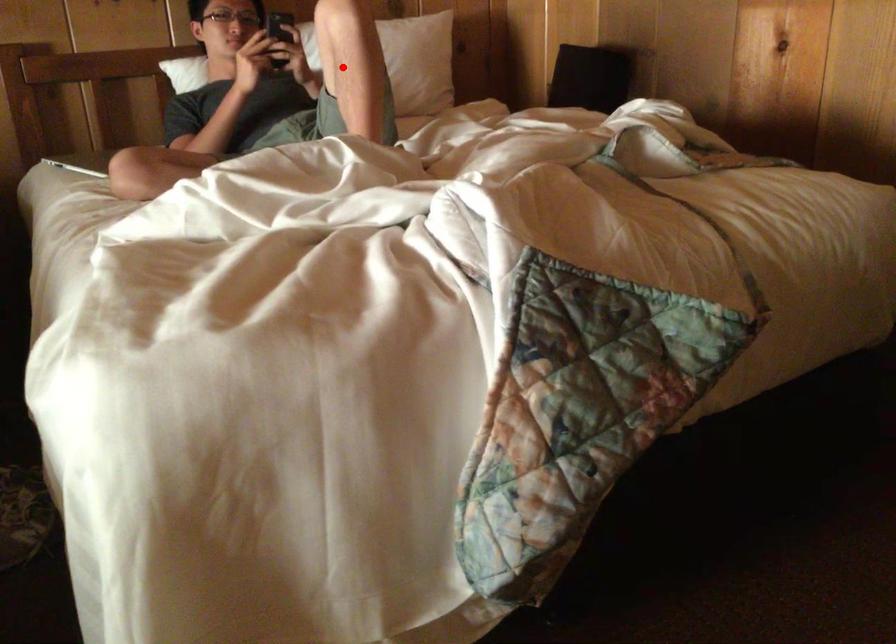
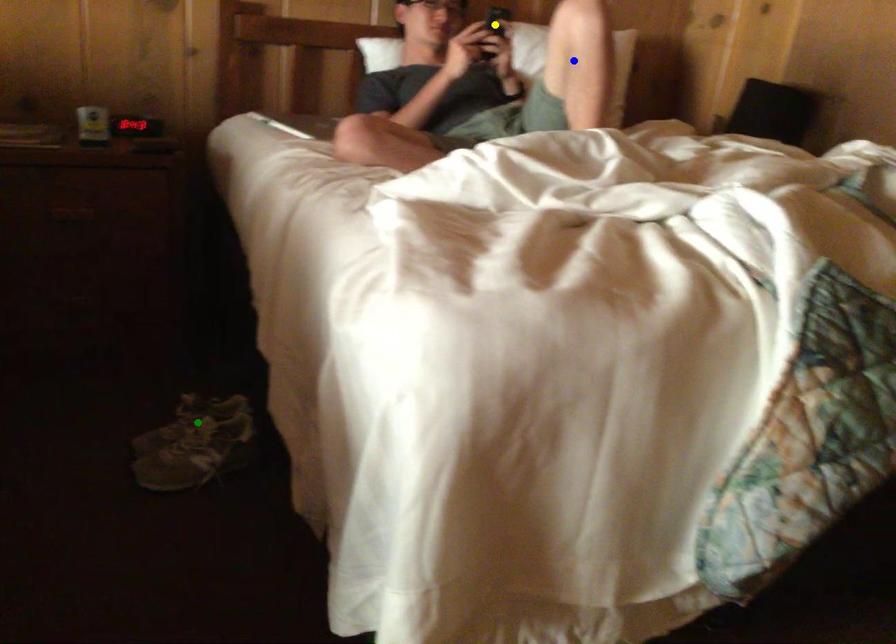
Question: I am providing you with two images of the same scene from different viewpoints. A red point is marked on the first image. You are given multiple points on the second image. Can you choose the point in image 2 that corresponds to the point in image 1?

Choices:
 (A) yellow point
 (B) blue point
 (C) green point

Answer: (B)